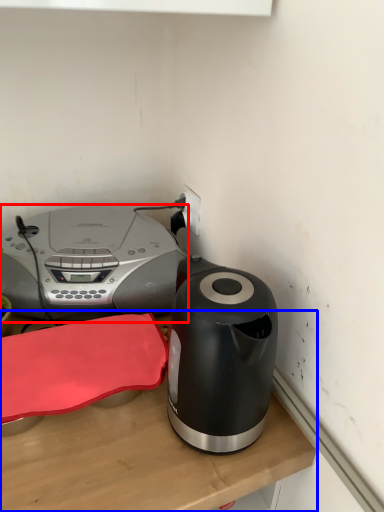
Question: Which object is closer to the camera taking this photo, home appliance (highlighted by a red box) or table (highlighted by a blue box)?

Choices:
 (A) home appliance
 (B) table

Answer: (B)